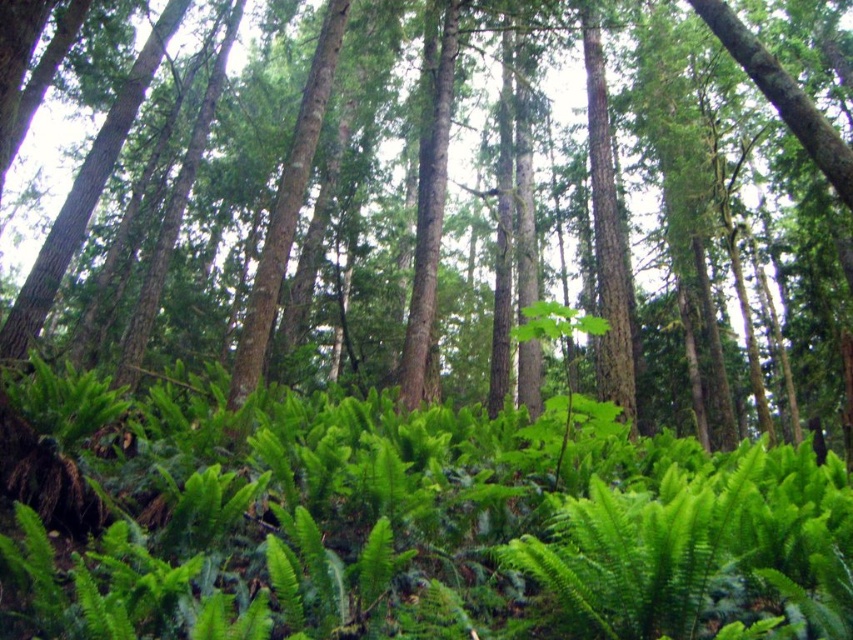
Which is behind, point (653, 448) or point (3, 24)?

Positioned behind is point (653, 448).

Measure the distance between green leafy fern at center and camera.

green leafy fern at center is 6.49 feet from camera.

Between point (51, 616) and point (585, 38), which one is positioned in front?

Point (51, 616)

You are a GUI agent. You are given a task and a screenshot of the screen. Output one action in this format:
    pyautogui.click(x=<x>, y=<y>)
    Task: Click on the green leafy fern at center
    The width and height of the screenshot is (853, 640).
    Given the screenshot: What is the action you would take?
    pyautogui.click(x=456, y=529)